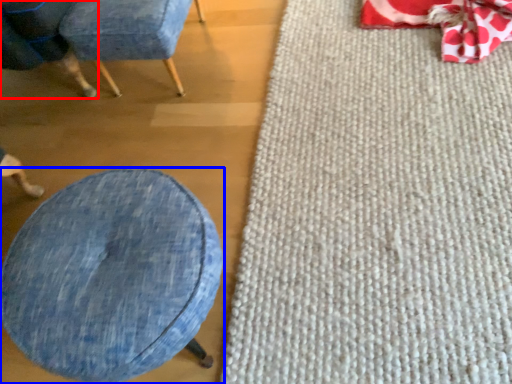
Question: Which of the following is the farthest to the observer, chair (highlighted by a red box) or furniture (highlighted by a blue box)?

Choices:
 (A) chair
 (B) furniture

Answer: (A)